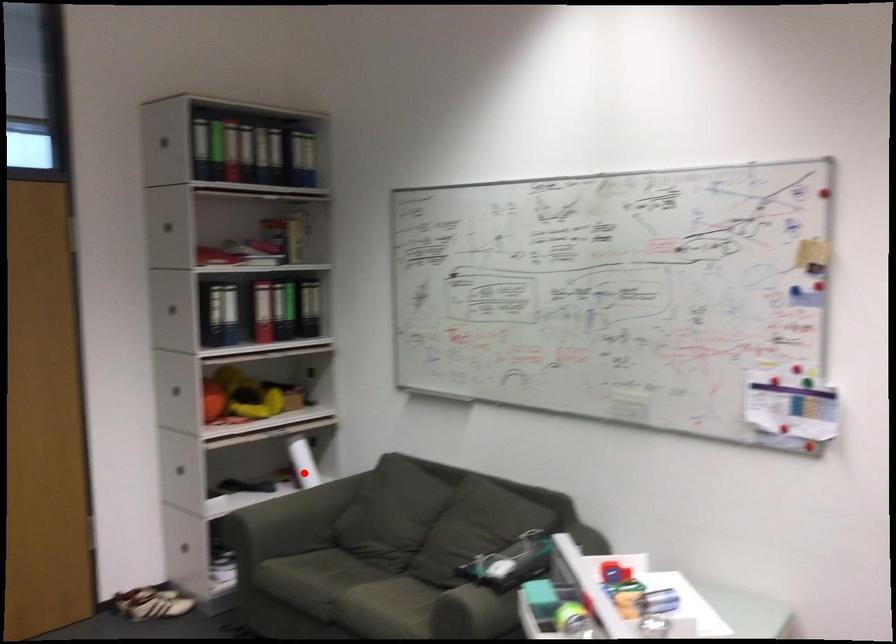
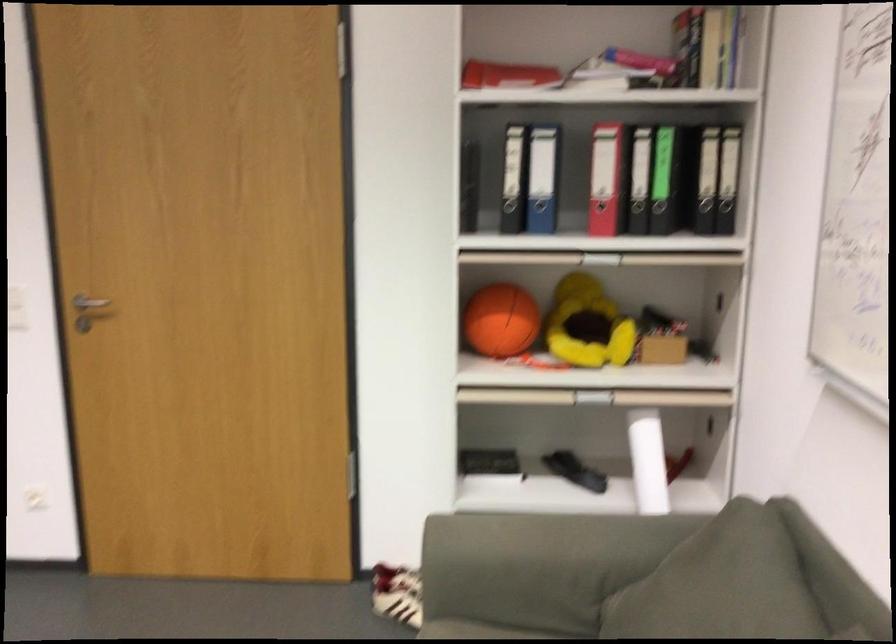
The point at the highlighted location is marked in the first image. Where is the corresponding point in the second image?

(648, 460)